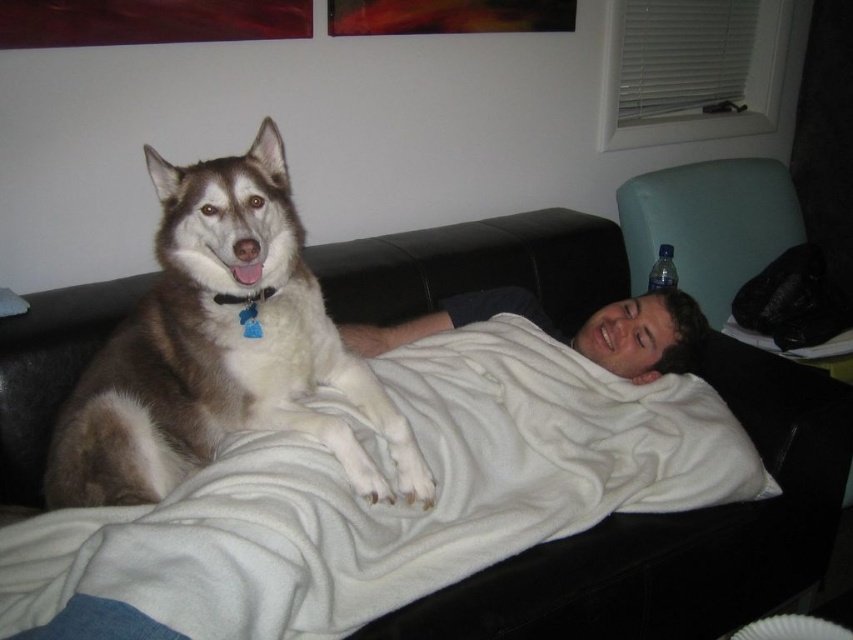
Question: Which point is closer to the camera taking this photo?

Choices:
 (A) coord(289,616)
 (B) coord(656,312)
 (C) coord(251,147)

Answer: (A)

Question: Which of the following is the farthest from the observer?

Choices:
 (A) white soft blanket at center
 (B) brown and white fur at center

Answer: (A)

Question: Can you confirm if white fleece blanket at center is thinner than brown and white fur at center?

Choices:
 (A) no
 (B) yes

Answer: (A)

Question: Does brown and white fur at center lie behind white soft blanket at center?

Choices:
 (A) no
 (B) yes

Answer: (A)

Question: Can you confirm if white fleece blanket at center is positioned to the left of brown and white fur at center?

Choices:
 (A) no
 (B) yes

Answer: (A)

Question: Which point is farther to the camera?

Choices:
 (A) (68, 556)
 (B) (189, 326)
 (C) (578, 348)

Answer: (C)